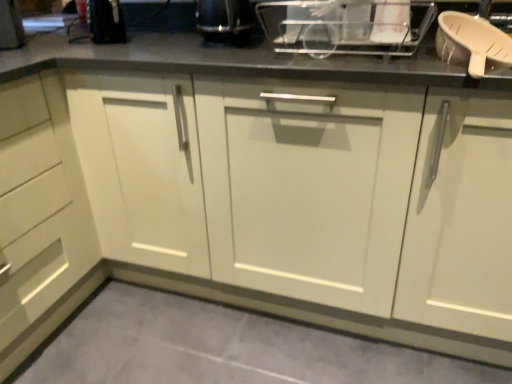
Question: In terms of width, does black plastic kettle at upper center, acting as the 1th appliance starting from the left, look wider or thinner when compared to white plastic dish rack at upper center, which appears as the first appliance when viewed from the right?

Choices:
 (A) wide
 (B) thin

Answer: (B)

Question: From the image's perspective, relative to white plastic dish rack at upper center, which appears as the first appliance when viewed from the right, is black plastic kettle at upper center, acting as the 1th appliance starting from the left, above or below?

Choices:
 (A) below
 (B) above

Answer: (B)

Question: Based on their relative distances, which object is farther from the black plastic kettle at upper center, acting as the 1th appliance starting from the left?

Choices:
 (A) white plastic dish rack at upper center, which appears as the first appliance when viewed from the right
 (B) gray tile floor at lower center

Answer: (B)

Question: Which object is positioned closest to the white plastic dish rack at upper center, the second appliance viewed from the left?

Choices:
 (A) gray tile floor at lower center
 (B) black plastic kettle at upper center, acting as the 1th appliance starting from the left

Answer: (B)